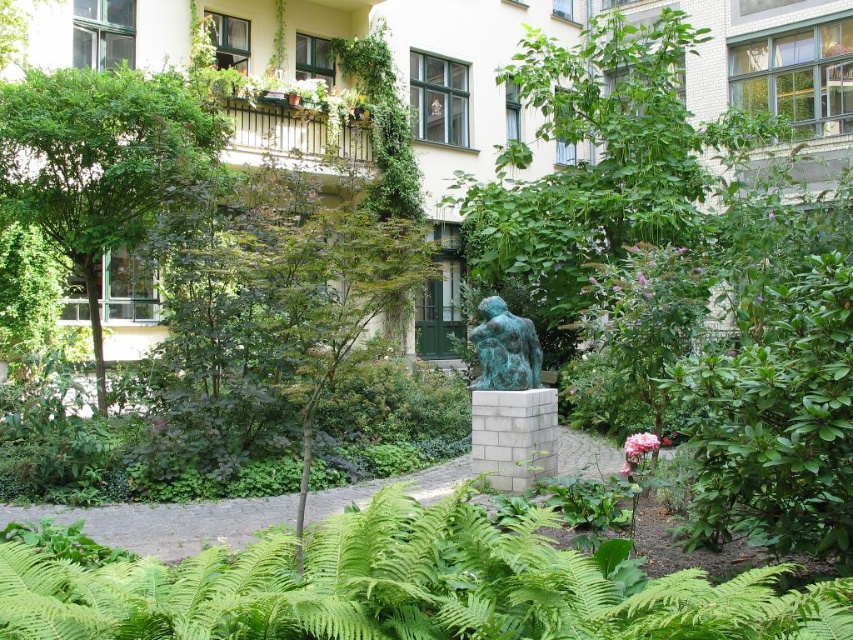
Is green leafy fern at lower center thinner than green patina statue at center?

Incorrect, green leafy fern at lower center's width is not less than green patina statue at center's.

Can you confirm if green leafy fern at lower center is positioned to the right of green patina statue at center?

No, green leafy fern at lower center is not to the right of green patina statue at center.

Is point (689, 602) less distant than point (531, 372)?

Yes, point (689, 602) is closer to viewer.

Find the location of a particular element. Image resolution: width=853 pixels, height=640 pixels. green leafy fern at lower center is located at coordinates (402, 588).

Who is more forward, (67, 186) or (495, 333)?

Point (495, 333)

Does green leafy tree at upper left appear on the right side of green patina statue at center?

No, green leafy tree at upper left is not to the right of green patina statue at center.

Is point (71, 188) positioned after point (485, 358)?

Yes, point (71, 188) is farther from viewer.

Where is `green leafy tree at upper left`? This screenshot has height=640, width=853. green leafy tree at upper left is located at coordinates (103, 161).

Between green leafy fern at lower center and green leafy tree at upper left, which one is positioned higher?

green leafy tree at upper left

Between point (718, 602) and point (57, 99), which one is positioned behind?

Positioned behind is point (57, 99).

The height and width of the screenshot is (640, 853). Identify the location of green leafy fern at lower center. click(x=402, y=588).